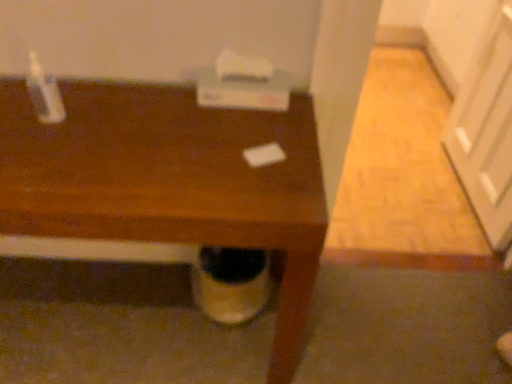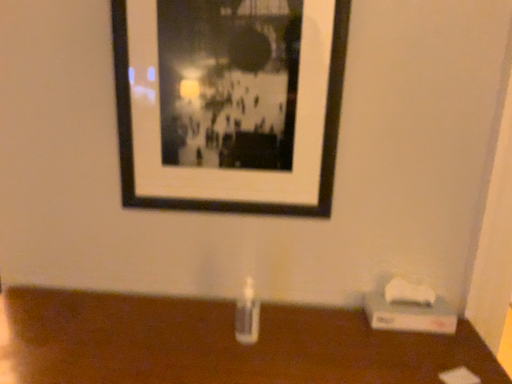
Question: How did the camera likely rotate when shooting the video?

Choices:
 (A) rotated downward
 (B) rotated upward

Answer: (B)